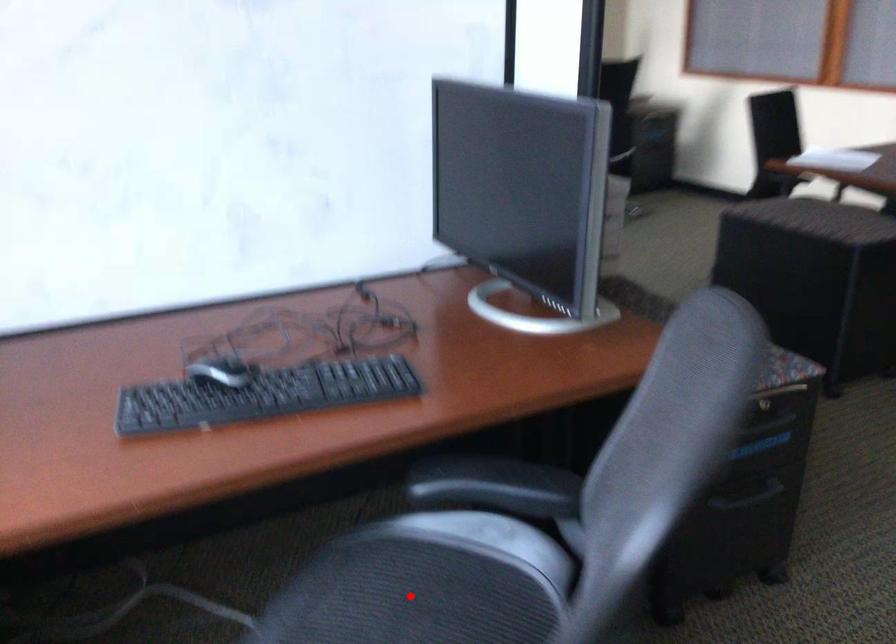
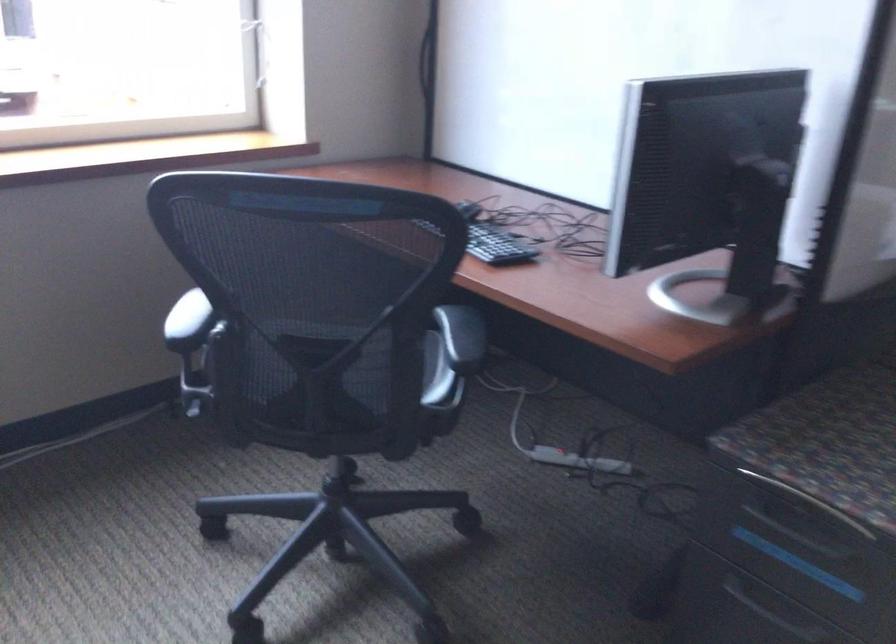
Question: I am providing you with two images of the same scene from different viewpoints. A red point is marked on the first image. Can you still see the location of the red point in image 2?

Choices:
 (A) Yes
 (B) No

Answer: (B)